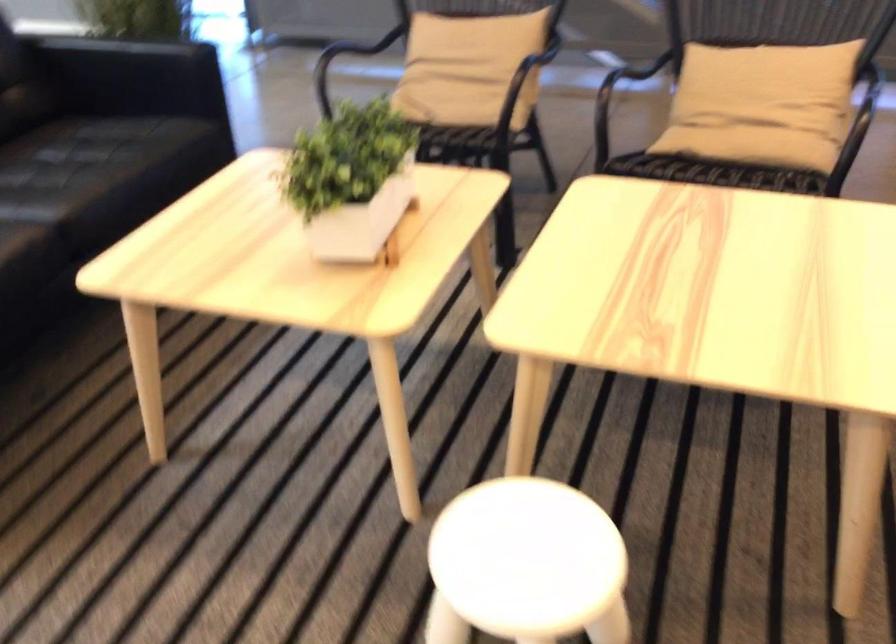
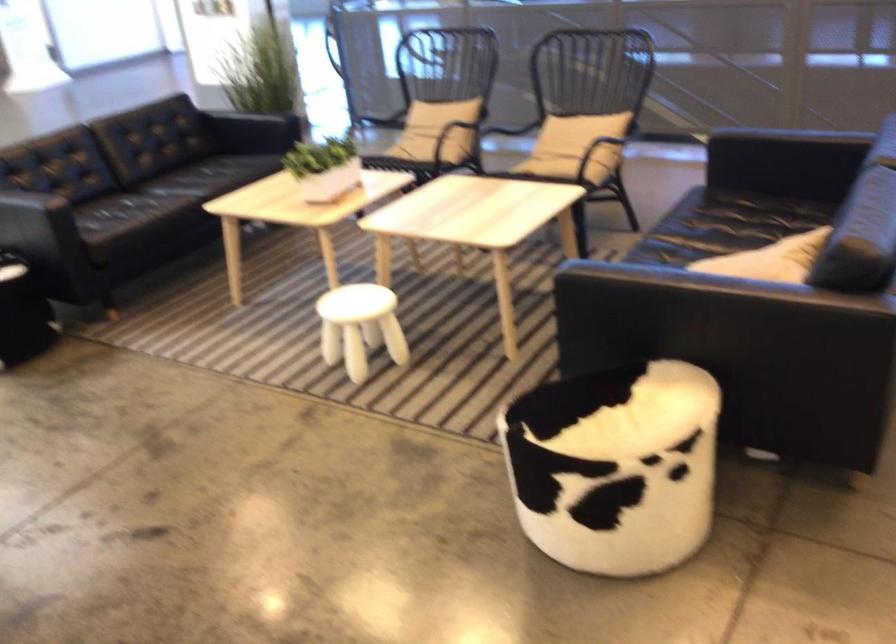
What movement of the cameraman would produce the second image?

The cameraman walked toward right, backward.